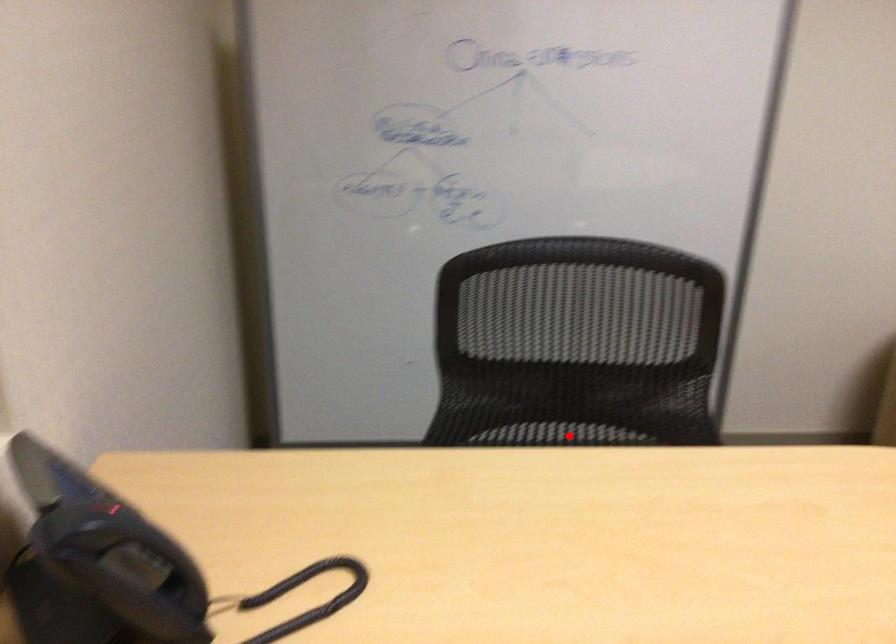
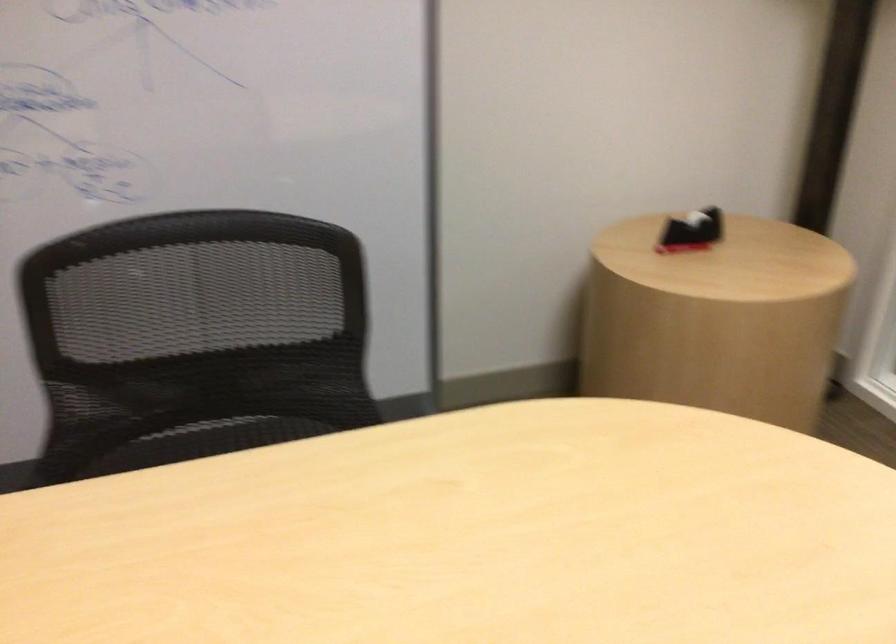
In the second image, find the point that corresponds to the highlighted location in the first image.

(218, 438)